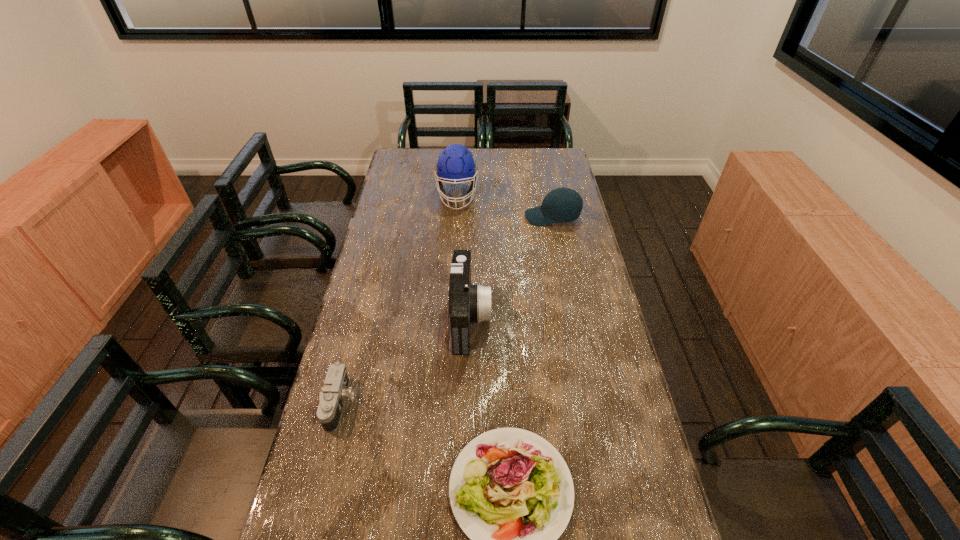
Locate an element on the screen. Image resolution: width=960 pixels, height=540 pixels. free space between the baseball cap and the leftmost object is located at coordinates (446, 310).

Identify the location of empty location between the camcorder and the baseball cap. tap(512, 268).

You are a GUI agent. You are given a task and a screenshot of the screen. Output one action in this format:
    pyautogui.click(x=<x>, y=<y>)
    Task: Click on the unoccupied position between the camcorder and the camera
    The width and height of the screenshot is (960, 540).
    Given the screenshot: What is the action you would take?
    pyautogui.click(x=405, y=361)

What are the coordinates of `empty location between the second shortest object and the baseball cap` in the screenshot? It's located at coord(446,310).

What are the coordinates of `vacant space that's between the third tallest object and the camera` in the screenshot? It's located at (446, 310).

Identify which object is the third nearest to the shortest object. Please provide its 2D coordinates. Your answer should be formatted as a tuple, i.e. [(x, y)], where the tuple contains the x and y coordinates of a point satisfying the conditions above.

[(563, 204)]

The image size is (960, 540). What are the coordinates of `object that is the closest one to the football helmet` in the screenshot? It's located at (563, 204).